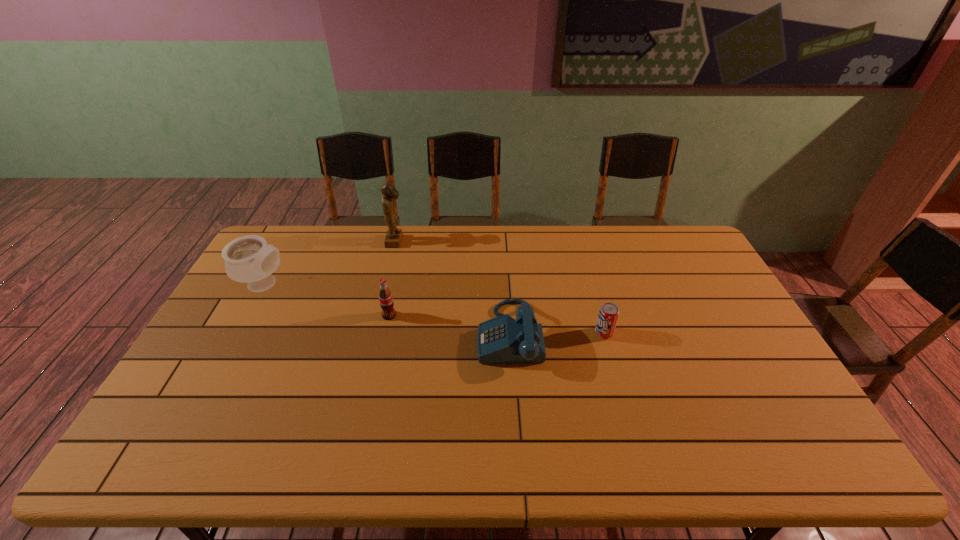
Identify the location of free location located 0.070m on the front of the pottery. The width and height of the screenshot is (960, 540). (248, 318).

Image resolution: width=960 pixels, height=540 pixels. In order to click on blank space located on the front of the farther soda can in this screenshot , I will do `click(381, 351)`.

The height and width of the screenshot is (540, 960). In order to click on free spot located 0.090m on the dial of the telephone in this screenshot , I will do `click(447, 334)`.

In order to click on vacant space situated 0.380m on the dial of the telephone in this screenshot , I will do `click(348, 334)`.

You are a GUI agent. You are given a task and a screenshot of the screen. Output one action in this format:
    pyautogui.click(x=<x>, y=<y>)
    Task: Click on the vacant space located 0.230m on the dial of the telephone
    The height and width of the screenshot is (540, 960).
    Given the screenshot: What is the action you would take?
    pyautogui.click(x=399, y=334)

This screenshot has height=540, width=960. I want to click on vacant space located 0.210m on the back of the nearer soda can, so click(588, 280).

You are a GUI agent. You are given a task and a screenshot of the screen. Output one action in this format:
    pyautogui.click(x=<x>, y=<y>)
    Task: Click on the object present at the far edge
    This screenshot has width=960, height=540.
    Given the screenshot: What is the action you would take?
    click(x=394, y=236)

The width and height of the screenshot is (960, 540). I want to click on object positioned at the left edge, so click(x=249, y=258).

Locate an element on the screen. Image resolution: width=960 pixels, height=540 pixels. vacant point at the far edge is located at coordinates (465, 247).

Where is `vacant space at the near edge`? vacant space at the near edge is located at coordinates (429, 438).